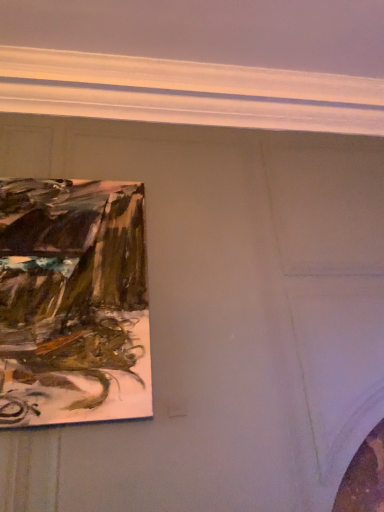
Describe the element at coordinates (73, 302) in the screenshot. This screenshot has height=512, width=384. I see `matte wooden frame at upper left` at that location.

This screenshot has height=512, width=384. Identify the location of matte wooden frame at upper left. (73, 302).

At what (x,y) coordinates should I click in order to perform the action: click on matte wooden frame at upper left. Please return your answer as a coordinate pair (x, y). This screenshot has width=384, height=512. Looking at the image, I should click on (73, 302).